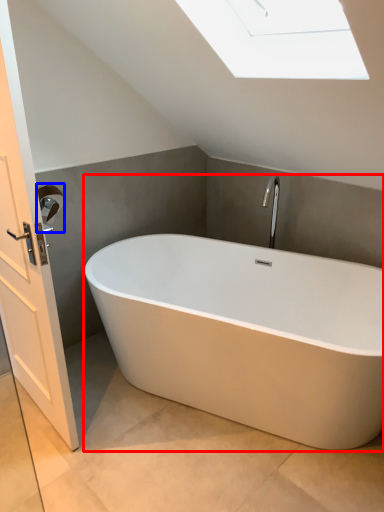
Question: Which object appears closest to the camera in this image, bathtub (highlighted by a red box) or towel bar (highlighted by a blue box)?

Choices:
 (A) bathtub
 (B) towel bar

Answer: (A)